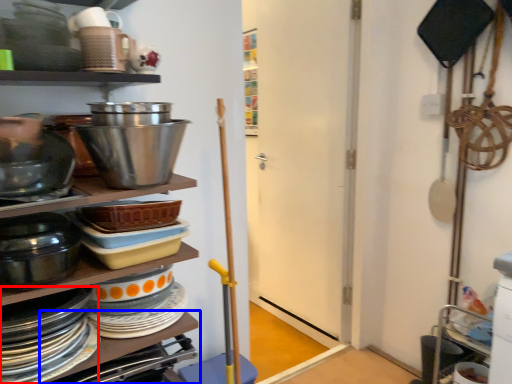
Question: Which object is closer to the camera taking this photo, platter (highlighted by a red box) or table (highlighted by a blue box)?

Choices:
 (A) platter
 (B) table

Answer: (A)